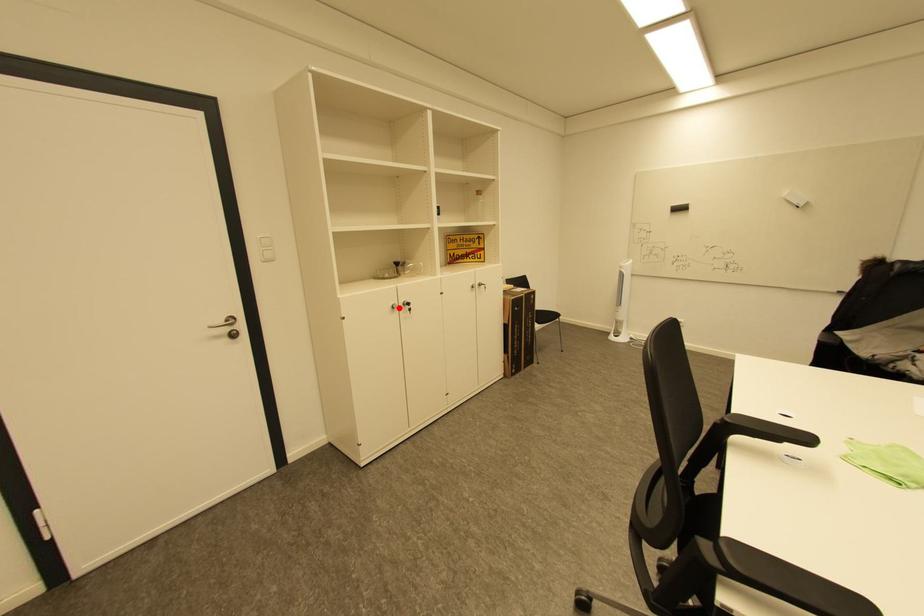
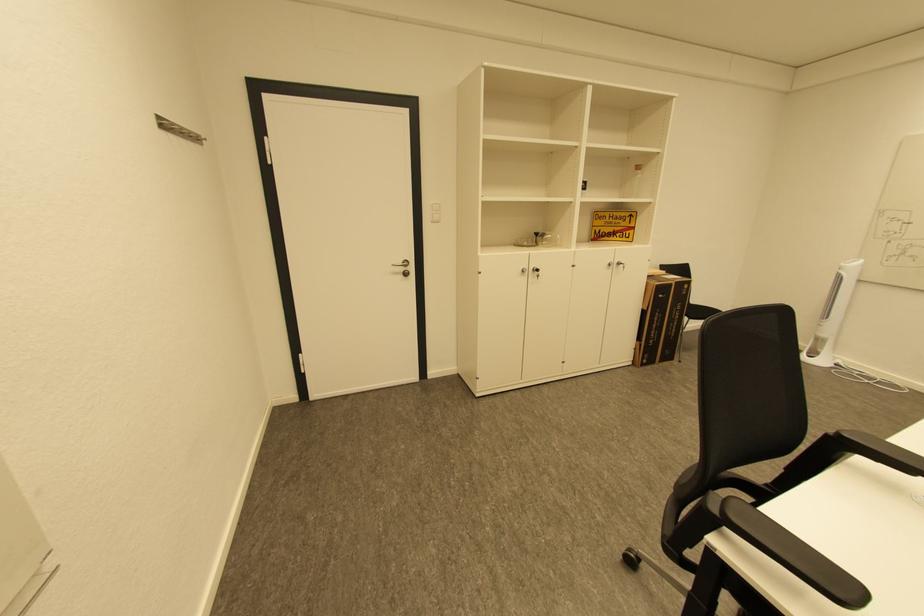
In the second image, find the point that corresponds to the highlighted location in the first image.

(529, 272)